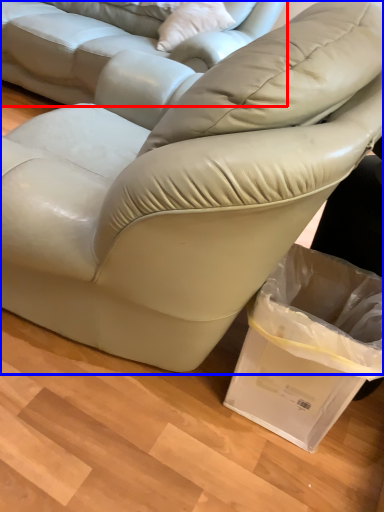
Question: Which of the following is the farthest to the observer, studio couch (highlighted by a red box) or studio couch (highlighted by a blue box)?

Choices:
 (A) studio couch
 (B) studio couch

Answer: (A)